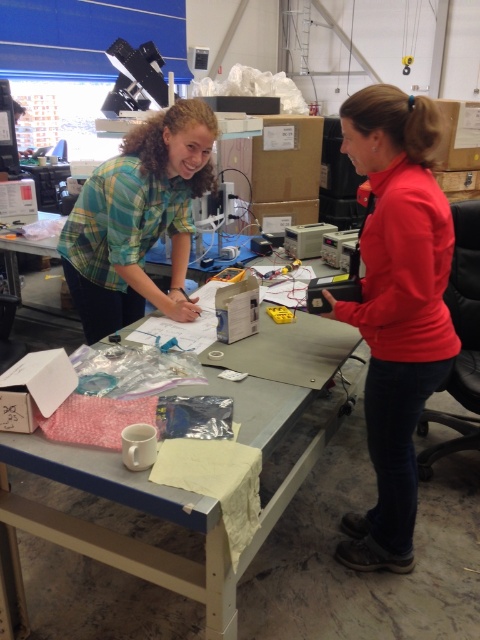
Who is higher up, red matte shirt at right or green plaid shirt at upper left?

green plaid shirt at upper left

Who is positioned more to the right, red matte shirt at right or green plaid shirt at upper left?

red matte shirt at right

Who is more forward, [369,346] or [73,260]?

Point [369,346]

Locate an element on the screen. Image resolution: width=480 pixels, height=640 pixels. red matte shirt at right is located at coordinates (396, 307).

Who is positioned more to the right, red matte shirt at right or metallic gray table at center?

From the viewer's perspective, red matte shirt at right appears more on the right side.

Which is above, red matte shirt at right or metallic gray table at center?

→ Positioned higher is red matte shirt at right.

Which is behind, point (387, 132) or point (226, 637)?

Positioned behind is point (387, 132).

Identify the location of red matte shirt at right. (396, 307).

Does metallic gray table at center lie behind green plaid shirt at upper left?

No.

Find the location of a particular element. This screenshot has width=480, height=640. metallic gray table at center is located at coordinates (148, 513).